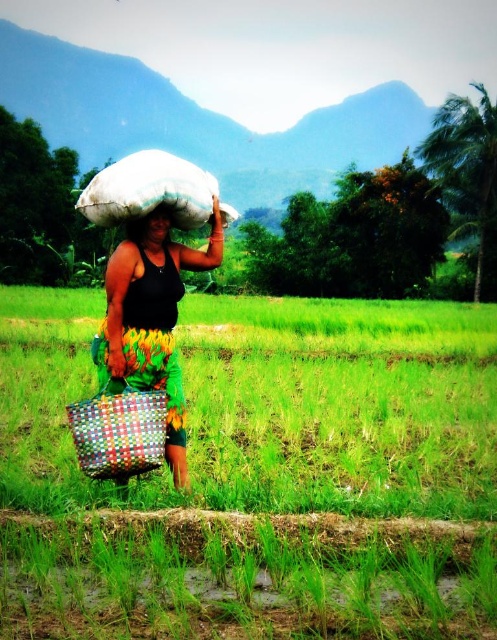
Which is more to the left, multicolored woven basket at center or multicolored woven basket at lower left?

multicolored woven basket at lower left is more to the left.

Which is behind, point (104, 360) or point (111, 401)?

The point (104, 360) is more distant.

Who is more distant from viewer, (175, 426) or (150, 456)?

The point (175, 426) is behind.

The width and height of the screenshot is (497, 640). I want to click on multicolored woven basket at center, so click(x=152, y=326).

Between multicolored woven basket at lower left and matte black head at upper center, which one has more height?

Standing taller between the two is multicolored woven basket at lower left.

Between multicolored woven basket at lower left and matte black head at upper center, which one is positioned lower?

Positioned lower is multicolored woven basket at lower left.

Describe the element at coordinates (118, 429) in the screenshot. I see `multicolored woven basket at lower left` at that location.

Where is `multicolored woven basket at lower left`? Image resolution: width=497 pixels, height=640 pixels. multicolored woven basket at lower left is located at coordinates (118, 429).

Who is more distant from viewer, (142, 282) or (195, 168)?

The point (195, 168) is behind.

Does multicolored woven basket at center have a lesser height compared to white fabric sack at center?

Correct, multicolored woven basket at center is not as tall as white fabric sack at center.

Locate an element on the screen. The image size is (497, 640). multicolored woven basket at center is located at coordinates (152, 326).